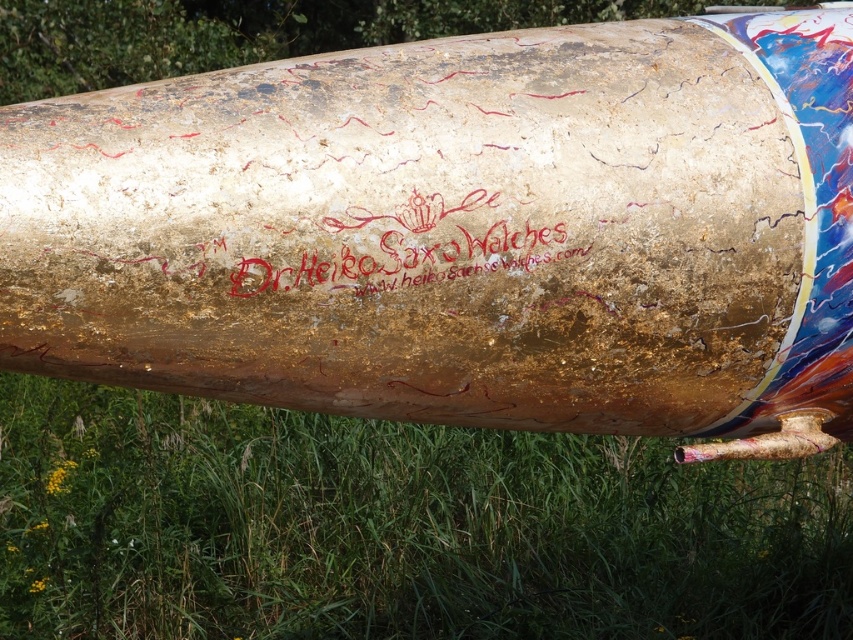
In order to click on gold metallic barrel at center in this screenshot , I will do `click(461, 230)`.

Between gold metallic barrel at center and green grass at lower center, which one has less height?

With less height is green grass at lower center.

Is point (91, 342) farther from camera compared to point (558, 576)?

No.

In order to click on gold metallic barrel at center in this screenshot , I will do `click(461, 230)`.